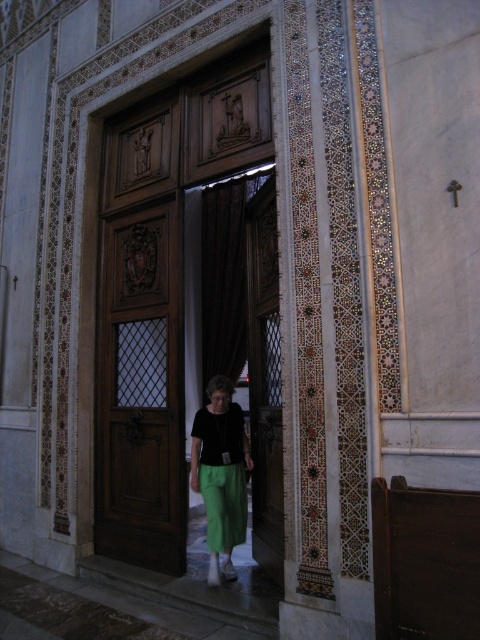
Question: Considering the real-world distances, which object is farthest from the wooden at center?

Choices:
 (A) green fabric skirt at center
 (B) polished wood door at center

Answer: (B)

Question: Is polished wood door at center thinner than wooden at center?

Choices:
 (A) no
 (B) yes

Answer: (A)

Question: From the image, what is the correct spatial relationship of polished wood door at center in relation to green fabric skirt at center?

Choices:
 (A) above
 (B) below

Answer: (A)

Question: Which object is farther from the camera taking this photo?

Choices:
 (A) green fabric skirt at center
 (B) polished wood door at center
 (C) wooden at center

Answer: (B)

Question: Does polished wood door at center have a larger size compared to green fabric skirt at center?

Choices:
 (A) no
 (B) yes

Answer: (B)

Question: Which is farther from the green fabric skirt at center?

Choices:
 (A) wooden at center
 (B) polished wood door at center

Answer: (B)